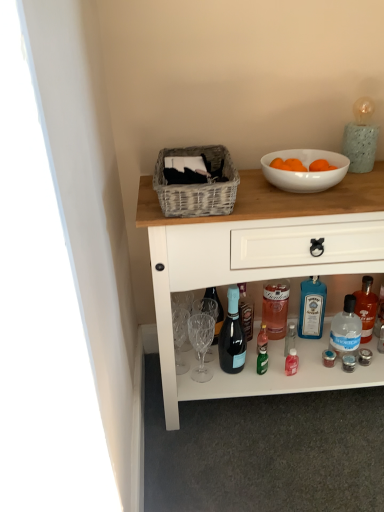
Question: Does white glossy bowl at upper right have a lesser width compared to transparent plastic bottle at lower right, the 2th bottle in the right-to-left sequence?

Choices:
 (A) yes
 (B) no

Answer: (B)

Question: Is white glossy bowl at upper right closer to the viewer compared to transparent plastic bottle at lower right, the second bottle viewed from the left?

Choices:
 (A) yes
 (B) no

Answer: (A)

Question: Can we say white glossy bowl at upper right lies outside transparent plastic bottle at lower right, the second bottle viewed from the left?

Choices:
 (A) no
 (B) yes

Answer: (B)

Question: Does white glossy bowl at upper right have a greater width compared to transparent plastic bottle at lower right, the second bottle viewed from the left?

Choices:
 (A) yes
 (B) no

Answer: (A)

Question: Does white glossy bowl at upper right have a greater height compared to transparent plastic bottle at lower right, the 2th bottle in the right-to-left sequence?

Choices:
 (A) no
 (B) yes

Answer: (A)

Question: Does point (220, 355) appear closer or farther from the camera than point (317, 180)?

Choices:
 (A) farther
 (B) closer

Answer: (A)

Question: Is matte black wine bottle at center wider or thinner than white glossy bowl at upper right?

Choices:
 (A) thin
 (B) wide

Answer: (A)

Question: From a real-world perspective, is matte black wine bottle at center above or below white glossy bowl at upper right?

Choices:
 (A) below
 (B) above

Answer: (A)

Question: Is matte black wine bottle at center in front of or behind white glossy bowl at upper right in the image?

Choices:
 (A) front
 (B) behind

Answer: (B)

Question: Is woven gray picnic basket at upper center spatially inside transparent plastic bottle at lower right, the second bottle viewed from the left, or outside of it?

Choices:
 (A) outside
 (B) inside

Answer: (A)

Question: Considering the positions of point (157, 159) and point (350, 312), is point (157, 159) closer or farther from the camera than point (350, 312)?

Choices:
 (A) farther
 (B) closer

Answer: (B)

Question: From the image's perspective, is woven gray picnic basket at upper center positioned above or below transparent plastic bottle at lower right, the 2th bottle in the right-to-left sequence?

Choices:
 (A) above
 (B) below

Answer: (A)

Question: Considering the positions of woven gray picnic basket at upper center and transparent plastic bottle at lower right, the 2th bottle in the right-to-left sequence, in the image, is woven gray picnic basket at upper center taller or shorter than transparent plastic bottle at lower right, the 2th bottle in the right-to-left sequence,?

Choices:
 (A) tall
 (B) short

Answer: (B)

Question: From the image's perspective, is clear plastic bottle at lower right, the first bottle positioned from the right, positioned above or below transparent plastic bottle at lower right, the 2th bottle in the right-to-left sequence?

Choices:
 (A) below
 (B) above

Answer: (B)

Question: In terms of height, does clear plastic bottle at lower right, which appears as the 3th bottle when viewed from the left, look taller or shorter compared to transparent plastic bottle at lower right, the second bottle viewed from the left?

Choices:
 (A) tall
 (B) short

Answer: (A)